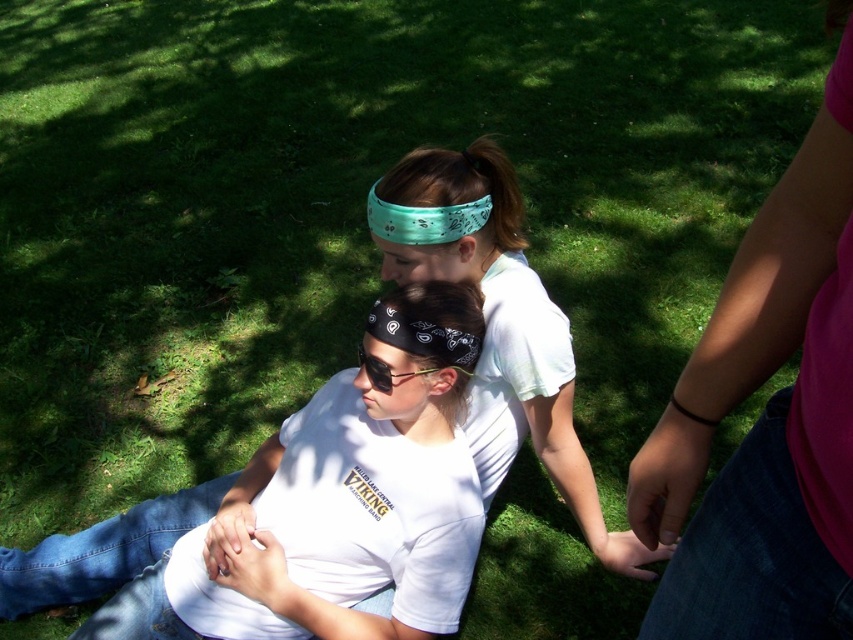
In the scene shown: You are standing in the grassy area and want to move towards the closer point between point (316, 406) and point (405, 376). Which point should you head towards?

Point (316, 406) is closer to you than point (405, 376), so you should head towards point (316, 406).

You are planning to place a 30 cm wide decoration between the pink fabric at upper right and the green bandana at center. Considering their widths, will the decoration fit without overlapping either object?

The pink fabric at upper right is narrower than the green bandana at center. Since the decoration is 30 cm wide, but we don not have exact measurements of their widths, it is uncertain if there is enough space between them for the decoration without overlapping.